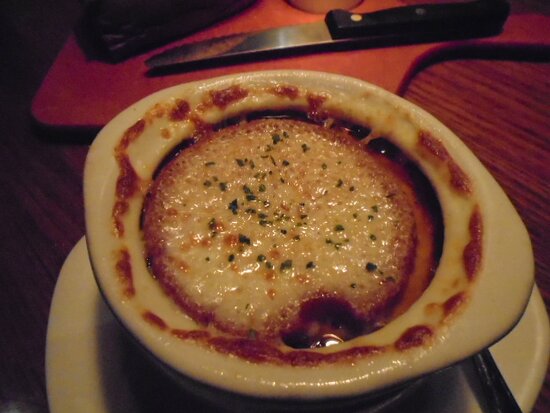
The image size is (550, 413). Identify the location of plate. (97, 371).